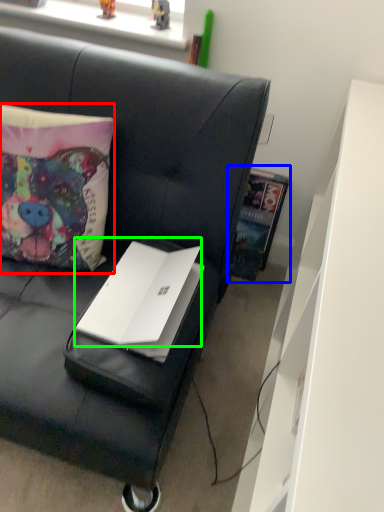
Question: Which object is positioned farthest from pillow (highlighted by a red box)? Select from book (highlighted by a blue box) and laptop (highlighted by a green box).

Choices:
 (A) book
 (B) laptop

Answer: (A)